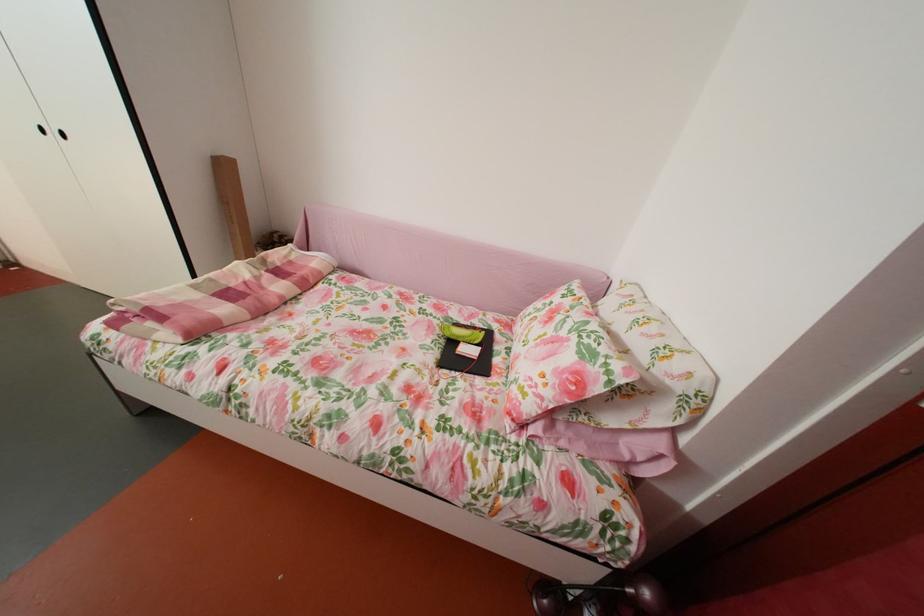
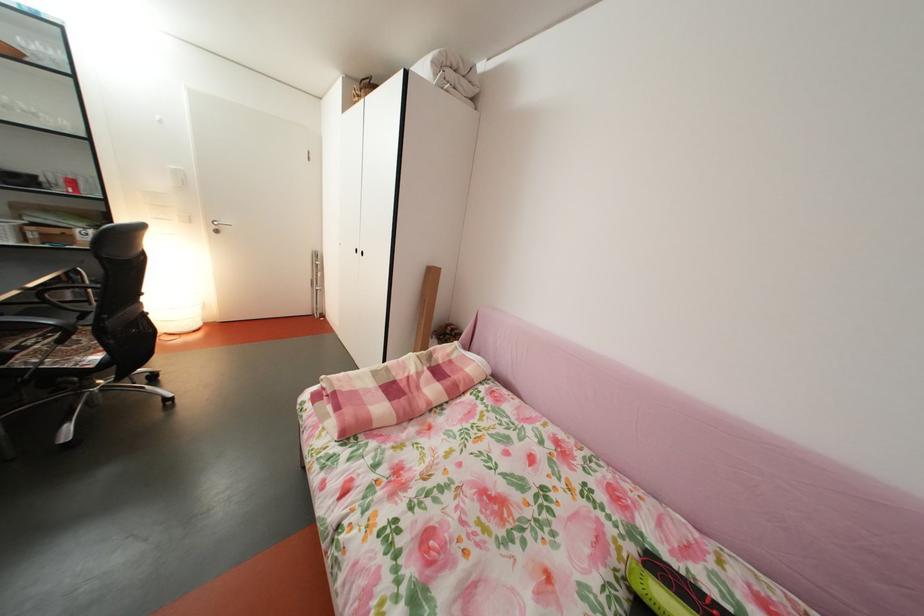
Question: Based on the continuous images, in which direction is the camera rotating? Reply with the corresponding letter.

Choices:
 (A) Left
 (B) Right
 (C) Up
 (D) Down

Answer: (A)